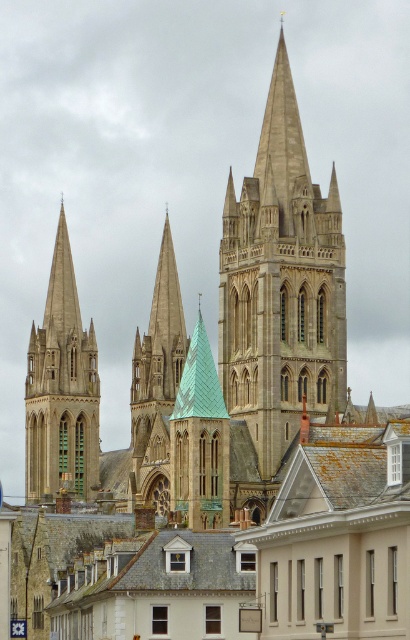
You are a tourist standing in front of the cathedral complex. You notice the light gray stone tower at center and the gray slate roof at center. Which of these two structures is positioned higher in the image?

The light gray stone tower at center is located above the gray slate roof at center, so it is positioned higher in the image.

You are a drone operator tasked with capturing aerial footage of the cathedral complex. Your drone has a maximum flight range of 60 meters from its starting position. If you position the drone at the stone spire at left, can it reach the gray slate roof at center without exceeding its range?

The distance between the stone spire at left and the gray slate roof at center is 58.13 meters, which is within the drone operator drone operator drone operator drone operator drone operator drone operator drone operator drone operator drone operator drone operator drone operator drone operator drone operator drone operator drone operator drone operator drone operator drone operator drone operator drone operator drone operator drone operator drone operator drone operator drone operator drone operator drone.